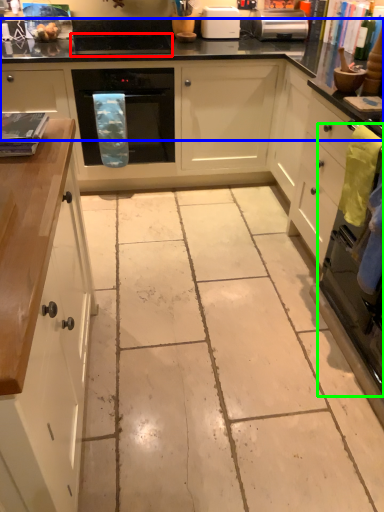
Question: Which is farther away from appliance (highlighted by a red box)? countertop (highlighted by a blue box) or oven (highlighted by a green box)?

Choices:
 (A) countertop
 (B) oven

Answer: (B)